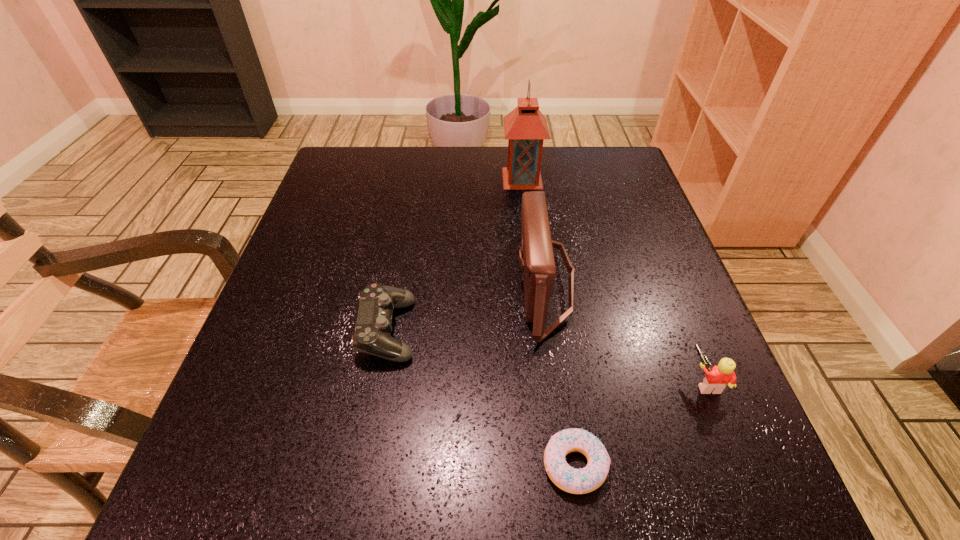
This screenshot has width=960, height=540. What are the coordinates of `object that is at the right edge` in the screenshot? It's located at (717, 378).

In the image, there is a desktop. Where is `vacant space at the far edge`? Image resolution: width=960 pixels, height=540 pixels. vacant space at the far edge is located at coordinates (558, 194).

Identify the location of vacant region at the left edge of the desktop. This screenshot has width=960, height=540. (341, 279).

In the image, there is a desktop. Where is `vacant space at the right edge`? The height and width of the screenshot is (540, 960). vacant space at the right edge is located at coordinates (653, 294).

In order to click on free region at the far left corner in this screenshot , I will do `click(369, 176)`.

Where is `blank space at the far right corner of the desktop`? The height and width of the screenshot is (540, 960). blank space at the far right corner of the desktop is located at coordinates (612, 186).

In the image, there is a desktop. Identify the location of vacant space at the near right corner. This screenshot has width=960, height=540. (728, 459).

The height and width of the screenshot is (540, 960). Find the location of `vacant space that is in between the rightmost object and the doughnut`. vacant space that is in between the rightmost object and the doughnut is located at coordinates (640, 423).

The width and height of the screenshot is (960, 540). I want to click on vacant area between the rightmost object and the nearest object, so click(x=640, y=423).

Identify the location of vacant space that is in between the farthest object and the Lego. (613, 280).